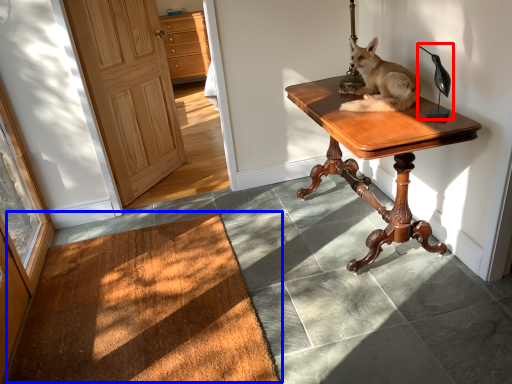
Question: Among these objects, which one is farthest to the camera, table lamp (highlighted by a red box) or doormat (highlighted by a blue box)?

Choices:
 (A) table lamp
 (B) doormat

Answer: (A)